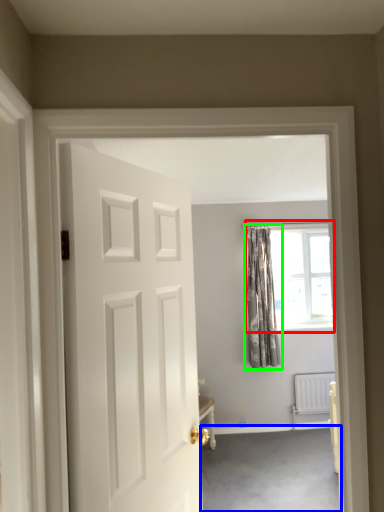
Question: Which is nearer to the window (highlighted by a red box)? plain (highlighted by a blue box) or curtain (highlighted by a green box).

Choices:
 (A) plain
 (B) curtain

Answer: (B)